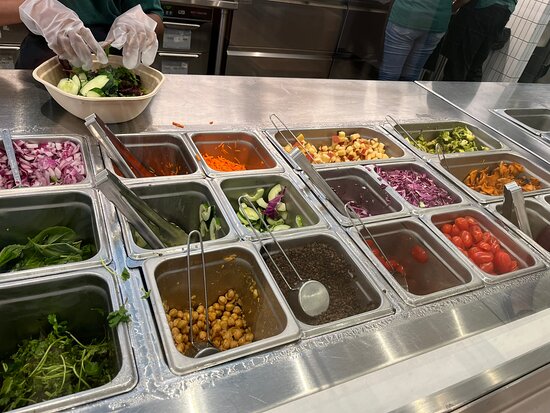
Where is `refrigerator doors`? This screenshot has height=413, width=550. refrigerator doors is located at coordinates (277, 27), (288, 65).